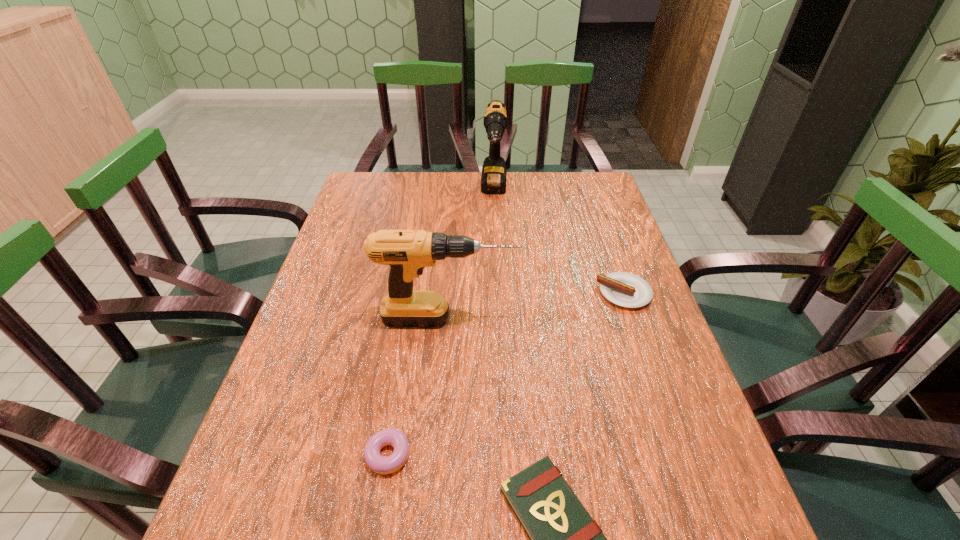
Where is `free space at the far edge`? free space at the far edge is located at coordinates pos(546,197).

In the image, there is a desktop. Identify the location of vacant space at the left edge. This screenshot has height=540, width=960. (274, 480).

Identify the location of vacant space at the right edge. The image size is (960, 540). (623, 395).

Image resolution: width=960 pixels, height=540 pixels. Find the location of `free space at the far left corner of the desktop`. free space at the far left corner of the desktop is located at coordinates (374, 181).

Find the location of `vacant space at the far right corner`. vacant space at the far right corner is located at coordinates (598, 175).

You are a GUI agent. You are given a task and a screenshot of the screen. Output one action in this format:
    pyautogui.click(x=<x>, y=<y>)
    Task: Click on the free spot between the sausage and the doughnut
    
    Given the screenshot: What is the action you would take?
    pyautogui.click(x=506, y=375)

Identify the location of free space between the farther drill and the rightmost object. Image resolution: width=960 pixels, height=540 pixels. (559, 242).

Where is `vacant area between the sausage and the farther drill`? vacant area between the sausage and the farther drill is located at coordinates (559, 242).

This screenshot has width=960, height=540. Find the location of `free spot between the doughnut and the sausage`. free spot between the doughnut and the sausage is located at coordinates click(506, 375).

Point out which object is positioned as the second nearest to the nearer drill. Please provide its 2D coordinates. Your answer should be formatted as a tuple, i.e. [(x, y)], where the tuple contains the x and y coordinates of a point satisfying the conditions above.

[(380, 464)]